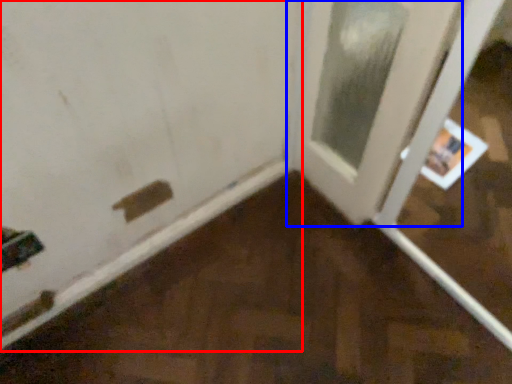
Question: Which point is closer to the camera, door (highlighted by a red box) or door (highlighted by a blue box)?

Choices:
 (A) door
 (B) door

Answer: (A)